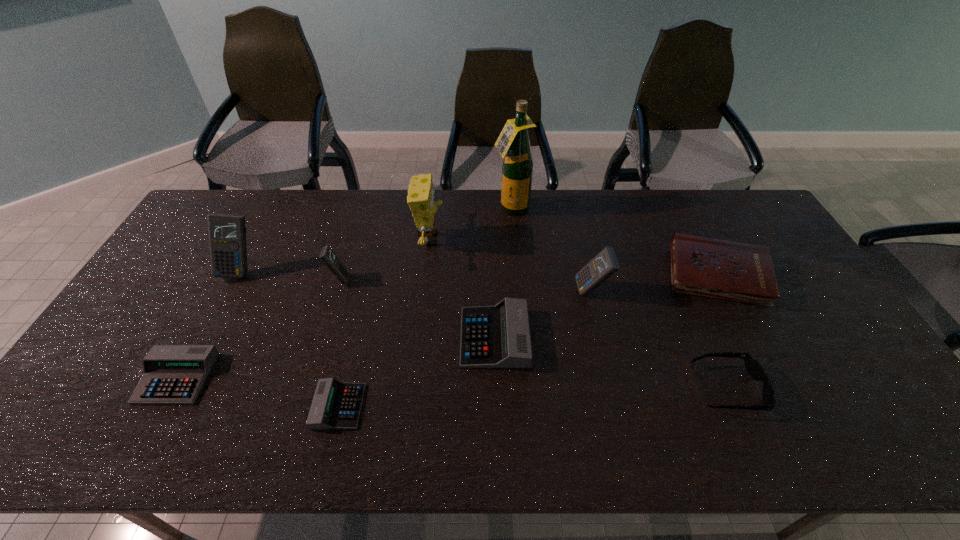
This screenshot has width=960, height=540. In order to click on free space at the right edge of the desktop in this screenshot , I will do `click(837, 394)`.

Identify the location of vacant space that is in between the smallest gray calculator and the black sunglasses. The width and height of the screenshot is (960, 540). (533, 397).

The height and width of the screenshot is (540, 960). Find the location of `free space between the hardback book and the tallest calculator`. free space between the hardback book and the tallest calculator is located at coordinates (479, 272).

You are a GUI agent. You are given a task and a screenshot of the screen. Output one action in this format:
    pyautogui.click(x=<x>, y=<y>)
    Task: Click on the vacant area between the sunglasses and the second shortest calculator
    This screenshot has height=540, width=960.
    Given the screenshot: What is the action you would take?
    pyautogui.click(x=452, y=383)

Locate an element on the screen. This screenshot has height=540, width=960. unoccupied position between the third tallest calculator and the fifth tallest calculator is located at coordinates (258, 328).

This screenshot has width=960, height=540. In order to click on free space between the fifth calculator from left to right and the smallest gray calculator in this screenshot , I will do `click(417, 372)`.

Find the location of a particular element. unoccupied position between the hardback book and the tallest object is located at coordinates (614, 241).

Locate an element on the screen. This screenshot has width=960, height=540. unoccupied area between the hardback book and the sixth shortest object is located at coordinates (528, 276).

At what (x,y) coordinates should I click in order to perform the action: click on vacant area that lies between the sunglasses and the fifth object from left to right. Please return your answer as a coordinate pair (x, y). This screenshot has width=960, height=540. Looking at the image, I should click on (579, 314).

Image resolution: width=960 pixels, height=540 pixels. Identify the location of free spot between the third object from right to left and the hardback book. (654, 282).